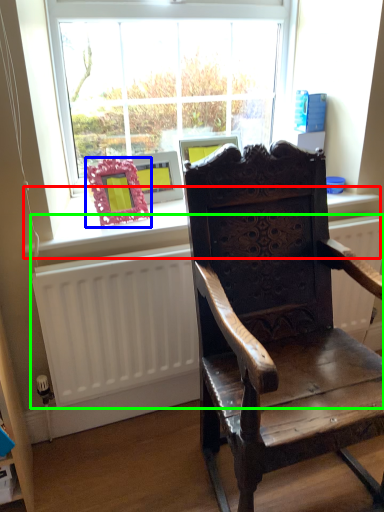
Question: Considering the real-world distances, which object is closest to window sill (highlighted by a red box)? picture frame (highlighted by a blue box) or radiator (highlighted by a green box).

Choices:
 (A) picture frame
 (B) radiator

Answer: (A)